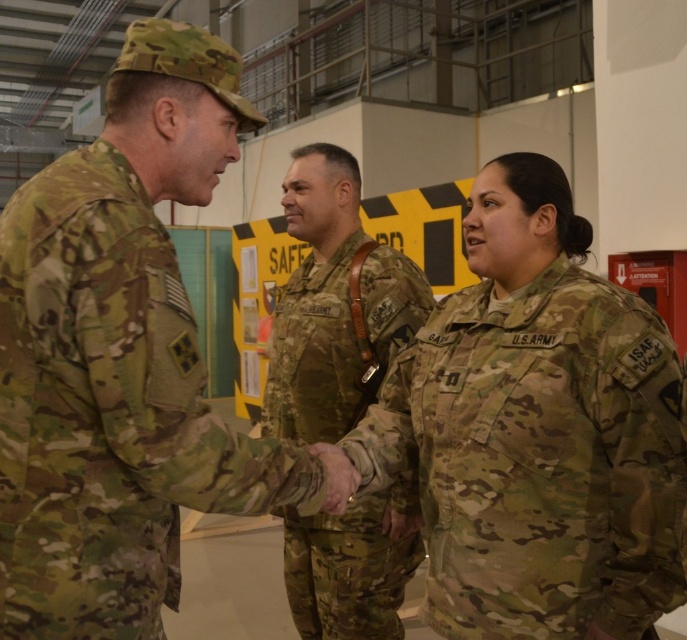
You are a drone operator trying to locate a specific point in the image. The scene shows three military personnel. One is at the center wearing a camo fabric uniform. Where is the camo fabric uniform at center located in terms of coordinates?

The camo fabric uniform at center is located at coordinates point (539, 458).

You are a photographer trying to capture a group photo of the three individuals in the scene. You notice that the camo fabric uniform at center and the camouflage fabric uniform at center are overlapping. Which uniform should you ask to move slightly to the right to avoid overlapping?

The camo fabric uniform at center has a larger width than the camouflage fabric uniform at center, so you should ask the camouflage fabric uniform at center to move slightly to the right to avoid overlapping.